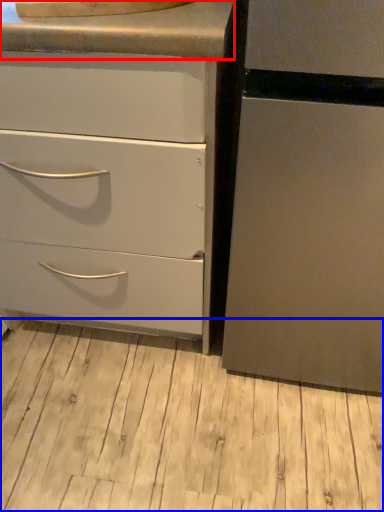
Question: Among these objects, which one is farthest to the camera, counter top (highlighted by a red box) or plank (highlighted by a blue box)?

Choices:
 (A) counter top
 (B) plank

Answer: (B)